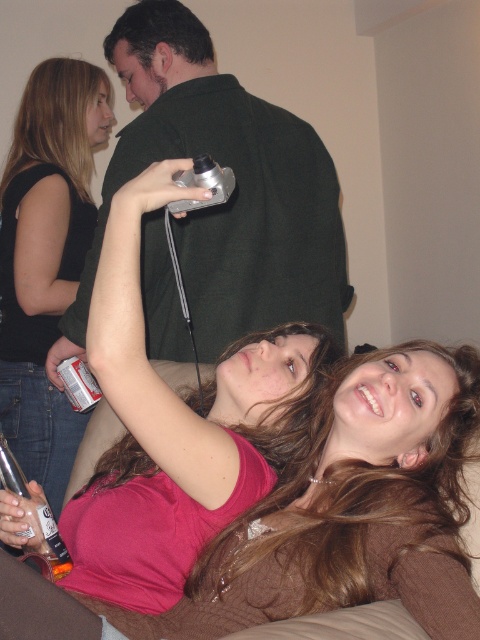
You are setting up a display shelf for a photography exhibition. You have to place the matte black camera at upper left and the silver metallic game controller at upper center. Since the shelf has limited space, which object should you place first to ensure both fit properly?

The matte black camera at upper left should be placed first because it is wider than the silver metallic game controller at upper center. This ensures there is enough space for both items on the shelf.

What are the coordinates of the green matte shirt at upper center in the image?

The coordinates of the green matte shirt at upper center are at point (232,193).

You are a photographer who needs to capture a wide shot of the group. You have a matte black camera at upper left and a silver metallic game controller at upper center. Which object should you move to ensure the camera is closer to the group?

You should move the silver metallic game controller at upper center because the matte black camera at upper left and silver metallic game controller at upper center are 31.49 inches apart, so moving the game controller would allow the camera to be closer to the group without disturbing its position.